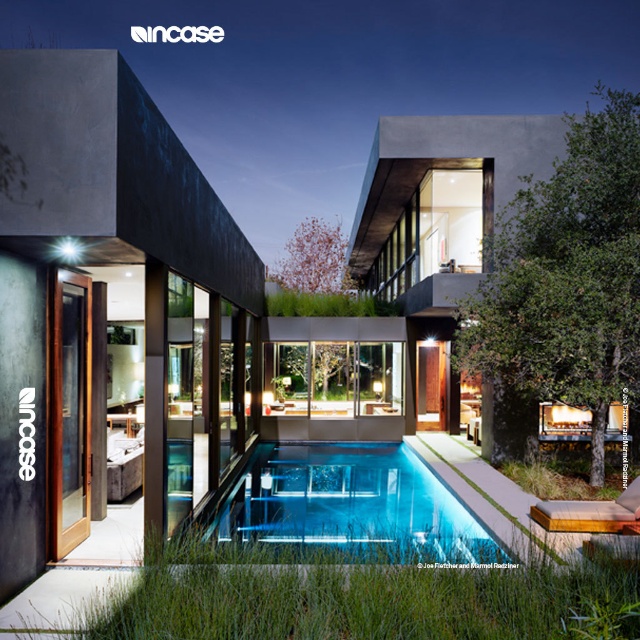
Is the position of blue glass pool at center less distant than that of transparent wood glass door at left?

Yes, blue glass pool at center is in front of transparent wood glass door at left.

The height and width of the screenshot is (640, 640). Identify the location of blue glass pool at center. (349, 506).